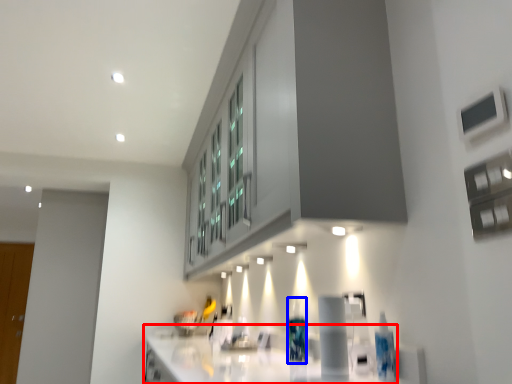
Question: Which object is closer to the camera taking this photo, countertop (highlighted by a red box) or bottle (highlighted by a blue box)?

Choices:
 (A) countertop
 (B) bottle

Answer: (A)